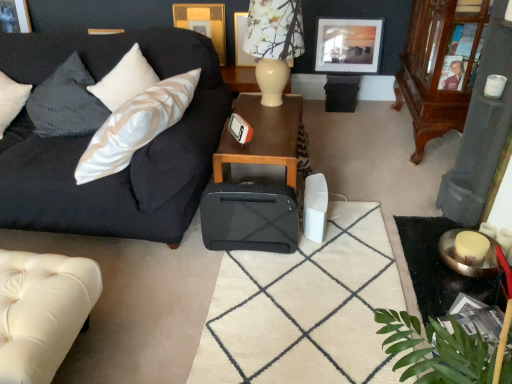
What is the approximate width of white leather studio couch at lower left, the 2th studio couch in the top-to-bottom sequence?

white leather studio couch at lower left, the 2th studio couch in the top-to-bottom sequence, is 55.37 centimeters wide.

Measure the distance between black fabric suitcase at center and camera.

The distance of black fabric suitcase at center from camera is 1.46 meters.

Measure the distance between mahogany wood dresser at right and camera.

The depth of mahogany wood dresser at right is 1.87 meters.

Where is `wooden picture frame at upper center, arranged as the second picture frame when viewed from the right`? wooden picture frame at upper center, arranged as the second picture frame when viewed from the right is located at coordinates (241, 41).

Where is `white leather studio couch at lower left, the 2th studio couch in the top-to-bottom sequence`? The image size is (512, 384). white leather studio couch at lower left, the 2th studio couch in the top-to-bottom sequence is located at coordinates (42, 311).

From the picture: Is white ceramic lamp at upper center far from green leafy plant at lower right?

white ceramic lamp at upper center is far away from green leafy plant at lower right.

Can you confirm if white ceramic lamp at upper center is taller than green leafy plant at lower right?

Correct, white ceramic lamp at upper center is much taller as green leafy plant at lower right.

From the image's perspective, relative to green leafy plant at lower right, is white ceramic lamp at upper center above or below?

Based on their image positions, white ceramic lamp at upper center is located above green leafy plant at lower right.

Could you tell me if white ceramic lamp at upper center is turned towards green leafy plant at lower right?

No, white ceramic lamp at upper center is not turned towards green leafy plant at lower right.

Considering the positions of points (27, 71) and (241, 44), is point (27, 71) closer to camera compared to point (241, 44)?

Yes, point (27, 71) is closer to viewer.

From a real-world perspective, is satin black couch at left, acting as the first studio couch starting from the top, located higher than wooden picture frame at upper center, the 3th picture frame in the left-to-right sequence?

Yes, from a real-world perspective, satin black couch at left, acting as the first studio couch starting from the top, is above wooden picture frame at upper center, the 3th picture frame in the left-to-right sequence.

Can we say satin black couch at left, the 2th studio couch positioned from the bottom, lies outside wooden picture frame at upper center, arranged as the second picture frame when viewed from the right?

Yes, satin black couch at left, the 2th studio couch positioned from the bottom, is outside of wooden picture frame at upper center, arranged as the second picture frame when viewed from the right.

Would you say wooden picture frame at upper left, acting as the 4th picture frame starting from the right, is to the left or to the right of satin black couch at left, acting as the first studio couch starting from the top, in the picture?

From the image, it's evident that wooden picture frame at upper left, acting as the 4th picture frame starting from the right, is to the left of satin black couch at left, acting as the first studio couch starting from the top.

Does wooden picture frame at upper left, acting as the 4th picture frame starting from the right, have a larger size compared to satin black couch at left, acting as the first studio couch starting from the top?

No.

Can you confirm if wooden picture frame at upper left, acting as the 4th picture frame starting from the right, is shorter than satin black couch at left, the 2th studio couch positioned from the bottom?

Yes.

Which is behind, wooden picture frame at upper left, placed as the 1th picture frame when sorted from left to right, or satin black couch at left, the 2th studio couch positioned from the bottom?

wooden picture frame at upper left, placed as the 1th picture frame when sorted from left to right, is further from the camera.

Which of these two, black fabric suitcase at center or wooden table at center, is smaller?

black fabric suitcase at center is smaller.

From a real-world perspective, is black fabric suitcase at center on wooden table at center?

No, from a real-world perspective, black fabric suitcase at center is not over wooden table at center

Based on the photo, considering the positions of objects black fabric suitcase at center and wooden table at center in the image provided, who is behind, black fabric suitcase at center or wooden table at center?

wooden table at center.

In terms of height, does black fabric suitcase at center look taller or shorter compared to wooden table at center?

Clearly, black fabric suitcase at center is shorter compared to wooden table at center.

Which is closer, (435, 122) or (28, 25)?

Point (435, 122) is positioned closer to the camera compared to point (28, 25).

Which is more to the left, mahogany wood dresser at right or wooden picture frame at upper left, placed as the 1th picture frame when sorted from left to right?

wooden picture frame at upper left, placed as the 1th picture frame when sorted from left to right, is more to the left.

Could you tell me if mahogany wood dresser at right is facing wooden picture frame at upper left, acting as the 4th picture frame starting from the right?

Yes, mahogany wood dresser at right is aimed at wooden picture frame at upper left, acting as the 4th picture frame starting from the right.

Looking at this image, how different are the orientations of mahogany wood dresser at right and wooden picture frame at upper left, placed as the 1th picture frame when sorted from left to right, in degrees?

There is a 89.4-degree angle between the facing directions of mahogany wood dresser at right and wooden picture frame at upper left, placed as the 1th picture frame when sorted from left to right.

From the picture: Which object is more forward, white leather studio couch at lower left, the 2th studio couch in the top-to-bottom sequence, or matte black picture frame at upper center, placed as the fourth picture frame when sorted from left to right?

Positioned in front is white leather studio couch at lower left, the 2th studio couch in the top-to-bottom sequence.

Considering the relative positions of white leather studio couch at lower left, the 2th studio couch in the top-to-bottom sequence, and matte black picture frame at upper center, placed as the fourth picture frame when sorted from left to right, in the image provided, is white leather studio couch at lower left, the 2th studio couch in the top-to-bottom sequence, to the right of matte black picture frame at upper center, placed as the fourth picture frame when sorted from left to right, from the viewer's perspective?

In fact, white leather studio couch at lower left, the 2th studio couch in the top-to-bottom sequence, is to the left of matte black picture frame at upper center, placed as the fourth picture frame when sorted from left to right.

Who is taller, white leather studio couch at lower left, the 2th studio couch in the top-to-bottom sequence, or matte black picture frame at upper center, marked as the 1th picture frame in a right-to-left arrangement?

matte black picture frame at upper center, marked as the 1th picture frame in a right-to-left arrangement.

Can you tell me how much white leather studio couch at lower left, the 1th studio couch positioned from the bottom, and matte black picture frame at upper center, marked as the 1th picture frame in a right-to-left arrangement, differ in facing direction?

The facing directions of white leather studio couch at lower left, the 1th studio couch positioned from the bottom, and matte black picture frame at upper center, marked as the 1th picture frame in a right-to-left arrangement, are 90.5 degrees apart.

Which point is more distant from viewer, (236,147) or (82,263)?

The point (236,147) is farther from the camera.

From a real-world perspective, who is located higher, wooden table at center or white leather studio couch at lower left, the 1th studio couch positioned from the bottom?

wooden table at center, from a real-world perspective.

Which of these two, wooden table at center or white leather studio couch at lower left, the 2th studio couch in the top-to-bottom sequence, is smaller?

With smaller size is white leather studio couch at lower left, the 2th studio couch in the top-to-bottom sequence.

Considering the positions of objects wooden table at center and white leather studio couch at lower left, the 1th studio couch positioned from the bottom, in the image provided, who is more to the right, wooden table at center or white leather studio couch at lower left, the 1th studio couch positioned from the bottom,?

wooden table at center.

The height and width of the screenshot is (384, 512). What are the coordinates of `plant below the white ceramic lamp at upper center (from a real-world perspective)` in the screenshot? It's located at (436, 350).

Locate an element on the screen. picture frame that is the 2nd one when counting upward from the satin black couch at left, the 2th studio couch positioned from the bottom (from the image's perspective) is located at coordinates (241, 41).

Based on their spatial positions, is white leather studio couch at lower left, the 1th studio couch positioned from the bottom, or wooden picture frame at upper left, acting as the 4th picture frame starting from the right, closer to white ceramic lamp at upper center?

white leather studio couch at lower left, the 1th studio couch positioned from the bottom.

From the image, which object appears to be nearer to wooden table at center, white leather studio couch at lower left, the 1th studio couch positioned from the bottom, or wooden picture frame at upper left, acting as the 4th picture frame starting from the right?

white leather studio couch at lower left, the 1th studio couch positioned from the bottom, lies closer to wooden table at center than the other object.

From the image, which object appears to be farther from satin black couch at left, the 2th studio couch positioned from the bottom, wooden picture frame at upper left, placed as the 1th picture frame when sorted from left to right, or black fabric suitcase at center?

wooden picture frame at upper left, placed as the 1th picture frame when sorted from left to right, lies further to satin black couch at left, the 2th studio couch positioned from the bottom, than the other object.

Looking at this image, when comparing their distances from white ceramic lamp at upper center, does satin black couch at left, acting as the first studio couch starting from the top, or wooden picture frame at upper left, acting as the 4th picture frame starting from the right, seem further?

Among the two, wooden picture frame at upper left, acting as the 4th picture frame starting from the right, is located further to white ceramic lamp at upper center.

When comparing their distances from white ceramic lamp at upper center, does white leather studio couch at lower left, the 1th studio couch positioned from the bottom, or satin black couch at left, acting as the first studio couch starting from the top, seem further?

white leather studio couch at lower left, the 1th studio couch positioned from the bottom, is further to white ceramic lamp at upper center.

Estimate the real-world distances between objects in this image. Which object is closer to matte black picture frame at upper center, placed as the fourth picture frame when sorted from left to right, green leafy plant at lower right or wooden picture frame at upper left, acting as the 4th picture frame starting from the right?

wooden picture frame at upper left, acting as the 4th picture frame starting from the right, is closer to matte black picture frame at upper center, placed as the fourth picture frame when sorted from left to right.

Based on their spatial positions, is wooden picture frame at upper center, the 3th picture frame in the left-to-right sequence, or green leafy plant at lower right further from wooden picture frame at upper left, acting as the 4th picture frame starting from the right?

green leafy plant at lower right is further to wooden picture frame at upper left, acting as the 4th picture frame starting from the right.

Considering their positions, is wooden table at center positioned further to wooden picture frame at upper center, the 3th picture frame in the left-to-right sequence, than matte black picture frame at upper center, placed as the fourth picture frame when sorted from left to right?

wooden table at center is positioned further to the anchor wooden picture frame at upper center, the 3th picture frame in the left-to-right sequence.

Find the location of a particular element. The width and height of the screenshot is (512, 384). picture frame positioned between white leather studio couch at lower left, the 2th studio couch in the top-to-bottom sequence, and wooden picture frame at upper center, which is the 3th picture frame in right-to-left order, from near to far is located at coordinates (348, 45).

This screenshot has width=512, height=384. In order to click on plain between white leather studio couch at lower left, the 2th studio couch in the top-to-bottom sequence, and wooden picture frame at upper left, placed as the 1th picture frame when sorted from left to right, from front to back in this screenshot , I will do `click(304, 308)`.

Find the location of a particular element. dresser that lies between wooden picture frame at upper center, the 3th picture frame in the left-to-right sequence, and green leafy plant at lower right from top to bottom is located at coordinates (436, 68).

This screenshot has width=512, height=384. Find the location of `plain positioned between white leather studio couch at lower left, the 1th studio couch positioned from the bottom, and wooden picture frame at upper center, the second picture frame when ordered from left to right, from near to far`. plain positioned between white leather studio couch at lower left, the 1th studio couch positioned from the bottom, and wooden picture frame at upper center, the second picture frame when ordered from left to right, from near to far is located at coordinates (304, 308).